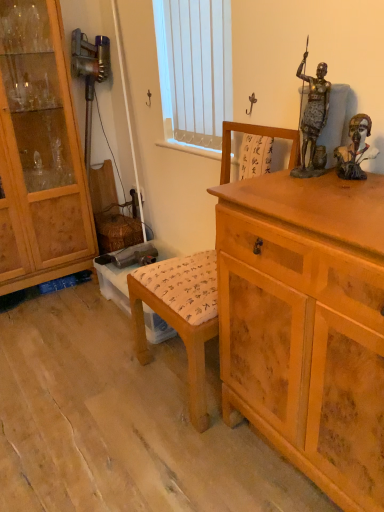
Locate an element on the screen. This screenshot has height=512, width=384. free space above light brown wooden chest of drawers at right (from a real-world perspective) is located at coordinates (334, 190).